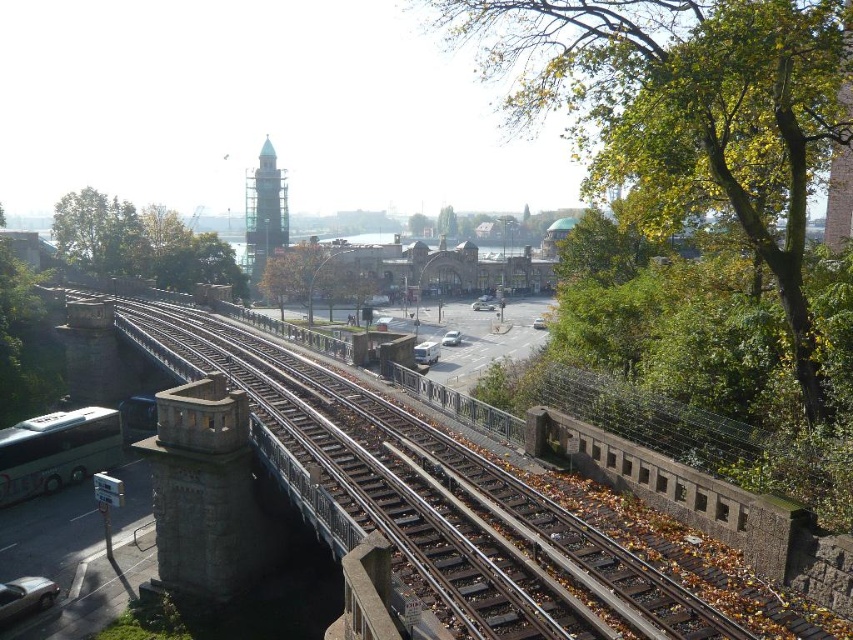
Question: Which point appears closest to the camera in this image?

Choices:
 (A) (541, 38)
 (B) (198, 257)
 (C) (0, 595)

Answer: (A)

Question: Can you confirm if green leafy tree at upper left is positioned above white glossy bus at lower left?

Choices:
 (A) no
 (B) yes

Answer: (B)

Question: Does green leafy tree at center come behind silver metallic car at lower left?

Choices:
 (A) no
 (B) yes

Answer: (B)

Question: Does green leafy tree at upper left appear on the right side of white matte van at center?

Choices:
 (A) yes
 (B) no

Answer: (B)

Question: Among these points, which one is farthest from the camera?

Choices:
 (A) (445, 340)
 (B) (84, 472)
 (C) (106, 220)
 (D) (436, 346)

Answer: (C)

Question: Estimate the real-world distances between objects in this image. Which object is closer to the white matte van at center?

Choices:
 (A) green leafy tree at upper left
 (B) white glossy bus at lower left
 (C) matte silver van at center

Answer: (C)